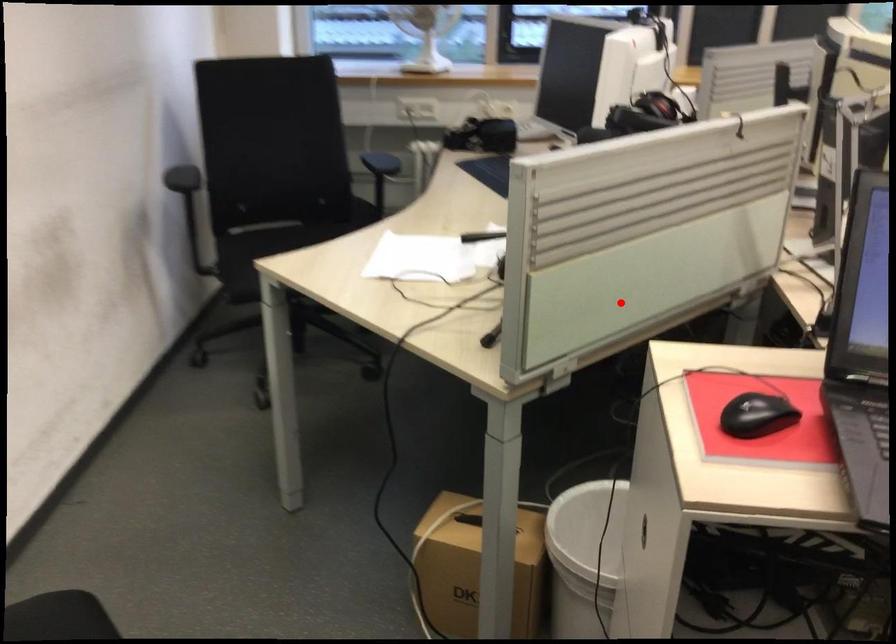
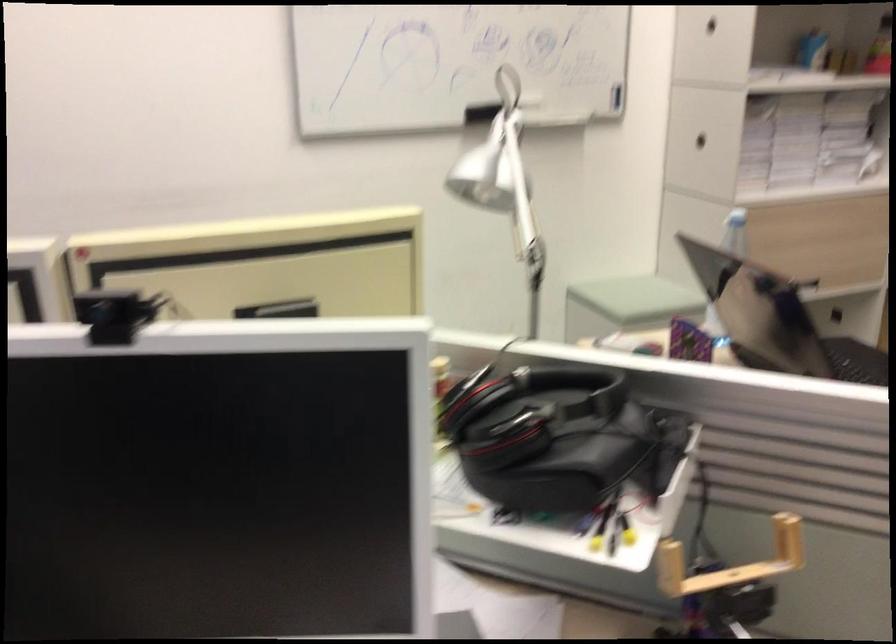
Question: I am providing you with two images of the same scene from different viewpoints. Image1 has a red point marked. In image2, the corresponding 3D location appears at what relative position? Reply with the corresponding letter.

Choices:
 (A) Closer
 (B) Farther

Answer: (A)